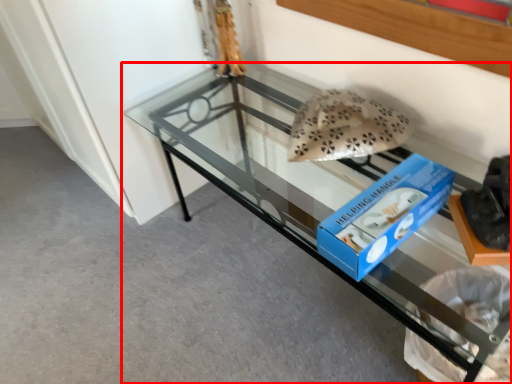
Question: From the image's perspective, considering the relative positions of furniture (annotated by the red box) and stuff in the image provided, where is furniture (annotated by the red box) located with respect to the staircase?

Choices:
 (A) above
 (B) below

Answer: (B)